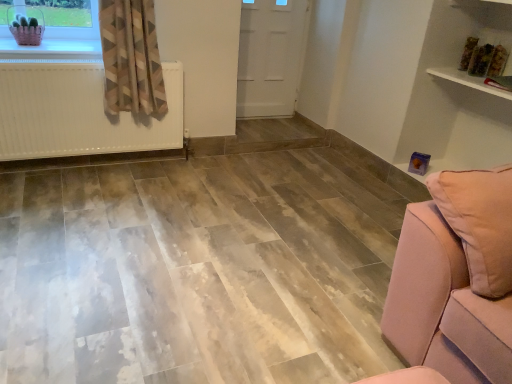
You are a GUI agent. You are given a task and a screenshot of the screen. Output one action in this format:
    pyautogui.click(x=<x>, y=<y>)
    Task: Click on the white glossy shelf at upper right
    The width and height of the screenshot is (512, 384).
    Given the screenshot: What is the action you would take?
    pyautogui.click(x=468, y=81)

The image size is (512, 384). What do you see at coordinates (78, 113) in the screenshot?
I see `white matte radiator at left` at bounding box center [78, 113].

You are a GUI agent. You are given a task and a screenshot of the screen. Output one action in this format:
    pyautogui.click(x=<x>, y=<y>)
    Task: Click on the geometric-patterned fabric curtain at left
    The height and width of the screenshot is (384, 512).
    Given the screenshot: What is the action you would take?
    pyautogui.click(x=131, y=57)

This screenshot has height=384, width=512. Find the location of `white glossy shelf at upper right`. white glossy shelf at upper right is located at coordinates (468, 81).

Who is shorter, white matte door at center or white glossy shelf at upper right?

With less height is white glossy shelf at upper right.

Considering the relative sizes of white matte door at center and white glossy shelf at upper right in the image provided, is white matte door at center wider than white glossy shelf at upper right?

No, white matte door at center is not wider than white glossy shelf at upper right.

Considering the relative positions of white matte door at center and white glossy shelf at upper right in the image provided, is white matte door at center in front of white glossy shelf at upper right?

That is False.

Is white matte door at center positioned beyond the bounds of white glossy shelf at upper right?

Yes.

From the image's perspective, which one is positioned lower, matte plastic basket at upper left or white glossy shelf at upper right?

white glossy shelf at upper right is shown below in the image.

Which is more distant, (92,45) or (458,76)?

Positioned behind is point (92,45).

Is matte plastic basket at upper left facing away from white glossy shelf at upper right?

That's not correct — matte plastic basket at upper left is not looking away from white glossy shelf at upper right.

Is matte plastic basket at upper left positioned behind white glossy shelf at upper right?

Yes, it is behind white glossy shelf at upper right.

From a real-world perspective, is white glossy shelf at upper right positioned over white matte radiator at left based on gravity?

Correct, in the physical world, white glossy shelf at upper right is higher than white matte radiator at left.

Is white glossy shelf at upper right oriented away from white matte radiator at left?

No, white glossy shelf at upper right is not facing away from white matte radiator at left.

Can you see white glossy shelf at upper right touching white matte radiator at left?

No, white glossy shelf at upper right is not next to white matte radiator at left.

Is matte plastic basket at upper left at the left side of white matte radiator at left?

Correct, you'll find matte plastic basket at upper left to the left of white matte radiator at left.

Is matte plastic basket at upper left next to white matte radiator at left and touching it?

matte plastic basket at upper left is not next to white matte radiator at left, and they're not touching.

Is matte plastic basket at upper left inside or outside of white matte radiator at left?

matte plastic basket at upper left exists outside the volume of white matte radiator at left.

From the image's perspective, would you say matte plastic basket at upper left is positioned over white matte radiator at left?

Indeed, from the image's perspective, matte plastic basket at upper left is shown above white matte radiator at left.

Considering the sizes of white glossy shelf at upper right and white matte door at center in the image, is white glossy shelf at upper right wider or thinner than white matte door at center?

Considering their sizes, white glossy shelf at upper right looks broader than white matte door at center.

In the scene shown: Which is more to the right, white glossy shelf at upper right or white matte door at center?

From the viewer's perspective, white glossy shelf at upper right appears more on the right side.

Looking at the image, does white glossy shelf at upper right seem bigger or smaller compared to white matte door at center?

white glossy shelf at upper right is smaller than white matte door at center.

From the image's perspective, which one is positioned lower, white glossy shelf at upper right or white matte door at center?

white glossy shelf at upper right.

From a real-world perspective, is white glossy shelf at upper right physically located above or below geometric-patterned fabric curtain at left?

In terms of real-world spatial position, white glossy shelf at upper right is above geometric-patterned fabric curtain at left.

Is white glossy shelf at upper right next to geometric-patterned fabric curtain at left and touching it?

No, white glossy shelf at upper right is not beside geometric-patterned fabric curtain at left.

Could geometric-patterned fabric curtain at left be considered to be inside white glossy shelf at upper right?

That's incorrect, geometric-patterned fabric curtain at left is not inside white glossy shelf at upper right.

From the image's perspective, which one is positioned higher, matte plastic basket at upper left or white matte door at center?

From the image's view, white matte door at center is above.

Considering the relative sizes of matte plastic basket at upper left and white matte door at center in the image provided, is matte plastic basket at upper left thinner than white matte door at center?

No, matte plastic basket at upper left is not thinner than white matte door at center.

Is matte plastic basket at upper left oriented away from white matte door at center?

matte plastic basket at upper left is not turned away from white matte door at center.

Is the surface of matte plastic basket at upper left in direct contact with white matte door at center?

No, matte plastic basket at upper left is not making contact with white matte door at center.

Where is `shelf in front of the white matte door at center`? The height and width of the screenshot is (384, 512). shelf in front of the white matte door at center is located at coordinates (468, 81).

The image size is (512, 384). Find the location of `window sill on the left of white glossy shelf at upper right`. window sill on the left of white glossy shelf at upper right is located at coordinates (52, 50).

When comparing their distances from white matte radiator at left, does matte plastic basket at upper left or white glossy shelf at upper right seem further?

The object further to white matte radiator at left is white glossy shelf at upper right.

When comparing their distances from white glossy shelf at upper right, does geometric-patterned fabric curtain at left or matte plastic basket at upper left seem closer?

geometric-patterned fabric curtain at left is closer to white glossy shelf at upper right.

Based on their spatial positions, is white matte door at center or geometric-patterned fabric curtain at left closer to white matte radiator at left?

geometric-patterned fabric curtain at left is positioned closer to the anchor white matte radiator at left.

Based on the photo, which object lies further to the anchor point white matte radiator at left, matte plastic basket at upper left or geometric-patterned fabric curtain at left?

matte plastic basket at upper left.

Considering their positions, is matte plastic basket at upper left positioned further to white glossy shelf at upper right than white matte radiator at left?

The object further to white glossy shelf at upper right is matte plastic basket at upper left.

From the image, which object appears to be nearer to white matte radiator at left, matte plastic basket at upper left or white matte door at center?

matte plastic basket at upper left.

Looking at this image, looking at the image, which one is located closer to matte plastic basket at upper left, white glossy shelf at upper right or geometric-patterned fabric curtain at left?

Among the two, geometric-patterned fabric curtain at left is located nearer to matte plastic basket at upper left.

Based on their spatial positions, is white matte radiator at left or matte plastic basket at upper left closer to white matte door at center?

white matte radiator at left is positioned closer to the anchor white matte door at center.

This screenshot has width=512, height=384. I want to click on radiator between geometric-patterned fabric curtain at left and white matte door at center from front to back, so (78, 113).

In order to click on door between white matte radiator at left and white glossy shelf at upper right from left to right in this screenshot , I will do `click(270, 56)`.

Find the location of a particular element. This screenshot has width=512, height=384. radiator located between matte plastic basket at upper left and geometric-patterned fabric curtain at left in the left-right direction is located at coordinates (78, 113).

Image resolution: width=512 pixels, height=384 pixels. What are the coordinates of `door between geometric-patterned fabric curtain at left and white glossy shelf at upper right from left to right` in the screenshot? It's located at (270, 56).